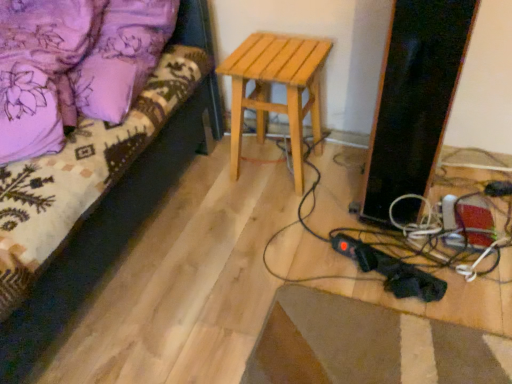
This screenshot has height=384, width=512. I want to click on free spot to the left of light brown wooden stool at center, so click(x=209, y=176).